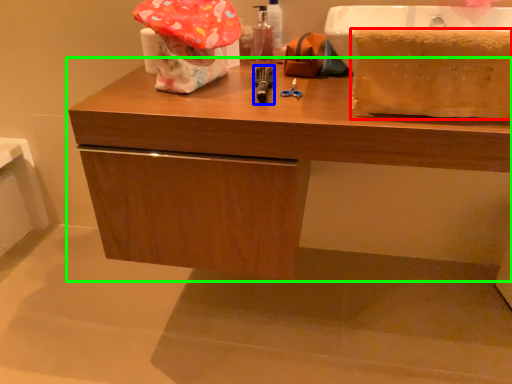
Question: Estimate the real-world distances between objects in this image. Which object is farther from blanket (highlighted by a red box), tool (highlighted by a blue box) or bathroom cabinet (highlighted by a green box)?

Choices:
 (A) tool
 (B) bathroom cabinet

Answer: (A)